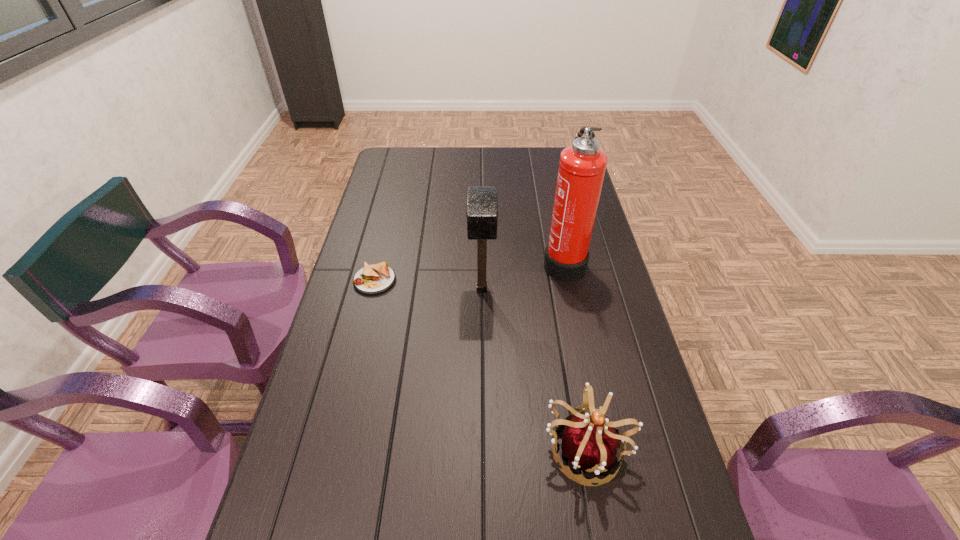
Find the location of a particular element. object identified as the closest to the tallest object is located at coordinates (482, 203).

Locate an element on the screen. free spot that satisfies the following two spatial constraints: 1. on the front side of the third shortest object; 2. on the left side of the shortest object is located at coordinates tap(372, 289).